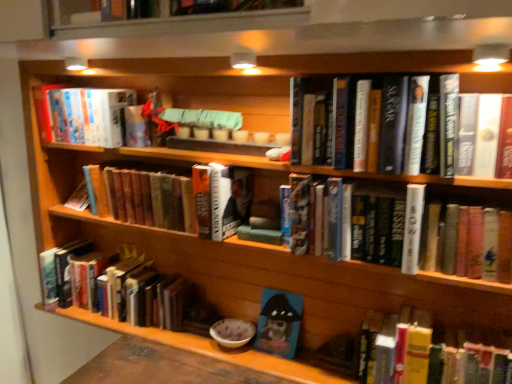
Question: Considering the relative positions of hardcover book at center, positioned as the 5th book in bottom-to-top order, and hardcover book at lower left, the 5th book positioned from the top, in the image provided, is hardcover book at center, positioned as the 5th book in bottom-to-top order, behind hardcover book at lower left, the 5th book positioned from the top,?

Choices:
 (A) no
 (B) yes

Answer: (A)

Question: Is the position of hardcover book at center, the second book in the top-to-bottom sequence, less distant than that of hardcover book at lower left, the 2th book positioned from the bottom?

Choices:
 (A) no
 (B) yes

Answer: (B)

Question: Does hardcover book at center, the second book in the top-to-bottom sequence, contain hardcover book at lower left, the 2th book positioned from the bottom?

Choices:
 (A) no
 (B) yes

Answer: (A)

Question: Considering the relative sizes of hardcover book at center, positioned as the 5th book in bottom-to-top order, and hardcover book at lower left, the 2th book positioned from the bottom, in the image provided, is hardcover book at center, positioned as the 5th book in bottom-to-top order, wider than hardcover book at lower left, the 2th book positioned from the bottom,?

Choices:
 (A) yes
 (B) no

Answer: (B)

Question: Is hardcover book at center, the second book in the top-to-bottom sequence, oriented away from hardcover book at lower left, the 2th book positioned from the bottom?

Choices:
 (A) yes
 (B) no

Answer: (B)

Question: Based on their sizes in the image, would you say hardcover book at center, positioned as the 4th book in bottom-to-top order, is bigger or smaller than hardcover book at center, the 4th book from the top?

Choices:
 (A) big
 (B) small

Answer: (B)

Question: In terms of height, does hardcover book at center, positioned as the 4th book in bottom-to-top order, look taller or shorter compared to hardcover book at center, the 4th book from the top?

Choices:
 (A) short
 (B) tall

Answer: (A)

Question: Is hardcover book at center, positioned as the 4th book in bottom-to-top order, spatially inside hardcover book at center, which is the 3th book from bottom to top, or outside of it?

Choices:
 (A) outside
 (B) inside

Answer: (A)

Question: In the image, is hardcover book at center, positioned as the 4th book in bottom-to-top order, positioned in front of or behind hardcover book at center, the 4th book from the top?

Choices:
 (A) front
 (B) behind

Answer: (B)

Question: Is hardcover book at center, which is the 3th book from bottom to top, in front of or behind hardcover book at center, positioned as the 3th book in top-to-bottom order, in the image?

Choices:
 (A) behind
 (B) front

Answer: (B)

Question: Is hardcover book at center, which is the 3th book from bottom to top, taller or shorter than hardcover book at center, positioned as the 3th book in top-to-bottom order?

Choices:
 (A) short
 (B) tall

Answer: (B)

Question: Is point (404, 244) positioned closer to the camera than point (160, 205)?

Choices:
 (A) closer
 (B) farther

Answer: (A)

Question: Visually, is hardcover book at center, the 4th book from the top, positioned to the left or to the right of hardcover book at center, positioned as the 4th book in bottom-to-top order?

Choices:
 (A) left
 (B) right

Answer: (B)

Question: From a real-world perspective, relative to hardcover book at center, the second book in the top-to-bottom sequence, is hardcover book at lower left, the 5th book positioned from the top, vertically above or below?

Choices:
 (A) above
 (B) below

Answer: (B)

Question: Is hardcover book at lower left, the 5th book positioned from the top, to the left or to the right of hardcover book at center, the second book in the top-to-bottom sequence, in the image?

Choices:
 (A) left
 (B) right

Answer: (A)